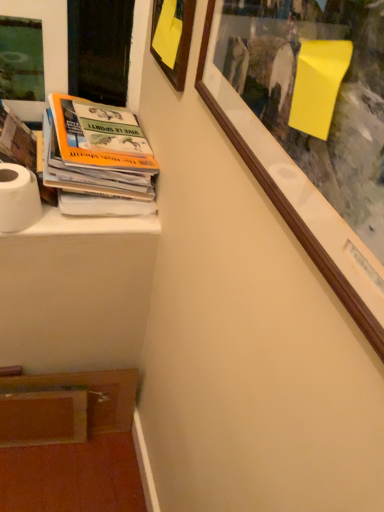
Question: Is white matte toilet paper at lower left thinner than wooden picture frame at upper left, placed as the second picture frame when sorted from right to left?

Choices:
 (A) no
 (B) yes

Answer: (A)

Question: Is white matte toilet paper at lower left oriented towards wooden picture frame at upper left, the 1th picture frame in the left-to-right sequence?

Choices:
 (A) no
 (B) yes

Answer: (A)

Question: Is wooden picture frame at upper left, the 1th picture frame in the left-to-right sequence, completely or partially inside white matte toilet paper at lower left?

Choices:
 (A) yes
 (B) no

Answer: (B)

Question: Does white matte toilet paper at lower left lie behind wooden picture frame at upper left, placed as the second picture frame when sorted from right to left?

Choices:
 (A) no
 (B) yes

Answer: (A)

Question: Is white matte toilet paper at lower left far away from wooden picture frame at upper left, placed as the second picture frame when sorted from right to left?

Choices:
 (A) no
 (B) yes

Answer: (A)

Question: From the image's perspective, is white matte toilet paper at lower left located above wooden picture frame at upper left, placed as the second picture frame when sorted from right to left?

Choices:
 (A) yes
 (B) no

Answer: (B)

Question: Does wooden picture frame at upper left, the 1th picture frame in the left-to-right sequence, have a lesser width compared to white matte toilet paper at lower left?

Choices:
 (A) no
 (B) yes

Answer: (B)

Question: From the image's perspective, is wooden picture frame at upper left, the 1th picture frame in the left-to-right sequence, on top of white matte toilet paper at lower left?

Choices:
 (A) yes
 (B) no

Answer: (A)

Question: Can you confirm if wooden picture frame at upper left, the 1th picture frame in the left-to-right sequence, is bigger than white matte toilet paper at lower left?

Choices:
 (A) yes
 (B) no

Answer: (A)

Question: Considering the relative sizes of wooden picture frame at upper left, the 1th picture frame in the left-to-right sequence, and white matte toilet paper at lower left in the image provided, is wooden picture frame at upper left, the 1th picture frame in the left-to-right sequence, shorter than white matte toilet paper at lower left?

Choices:
 (A) no
 (B) yes

Answer: (A)

Question: Would you say white matte toilet paper at lower left is part of wooden picture frame at upper left, placed as the second picture frame when sorted from right to left,'s contents?

Choices:
 (A) yes
 (B) no

Answer: (B)

Question: Does wooden picture frame at upper left, placed as the second picture frame when sorted from right to left, have a smaller size compared to white matte toilet paper at lower left?

Choices:
 (A) yes
 (B) no

Answer: (B)

Question: Could you tell me if wooden picture frame at upper left, the 1th picture frame in the left-to-right sequence, is facing wooden picture frame at upper center, which appears as the second picture frame when viewed from the left?

Choices:
 (A) yes
 (B) no

Answer: (B)